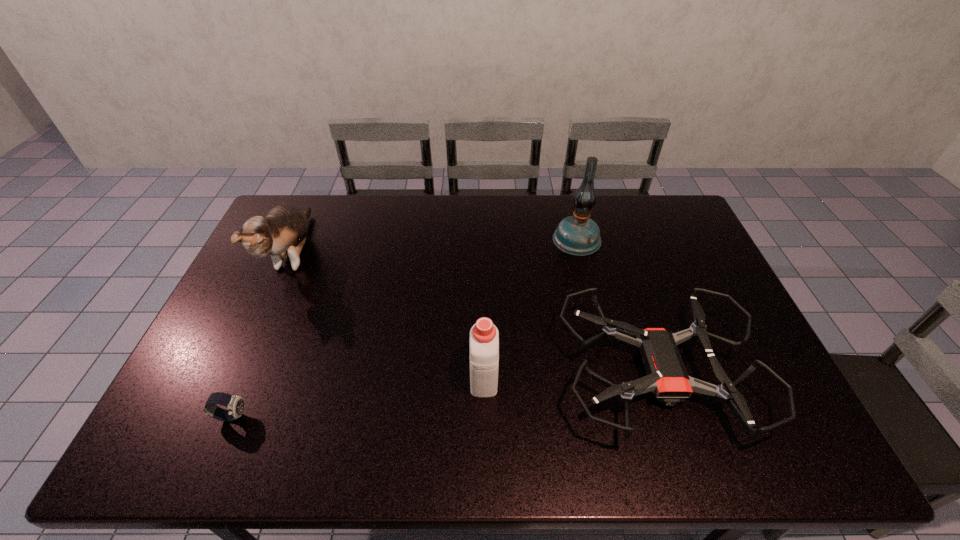
This screenshot has width=960, height=540. What are the coordinates of `oil lamp` in the screenshot? It's located at (579, 235).

Where is `cat`? The height and width of the screenshot is (540, 960). cat is located at coordinates (282, 232).

Where is `the third object from right to left`? The width and height of the screenshot is (960, 540). the third object from right to left is located at coordinates (484, 337).

At what (x,y) coordinates should I click in order to perform the action: click on detergent. Please return your answer as a coordinate pair (x, y). This screenshot has height=540, width=960. Looking at the image, I should click on (484, 337).

Locate an element on the screen. This screenshot has width=960, height=540. drone is located at coordinates (667, 378).

Identify the location of watch. The height and width of the screenshot is (540, 960). (235, 404).

This screenshot has height=540, width=960. Identify the location of vacant position located 0.260m on the right of the tallest object. (675, 239).

The width and height of the screenshot is (960, 540). I want to click on vacant position located at the face of the cat, so click(x=218, y=423).

Find the location of a particular element. vacant space located on the handle side of the detergent is located at coordinates (483, 274).

I want to click on vacant space located on the handle side of the detergent, so click(483, 255).